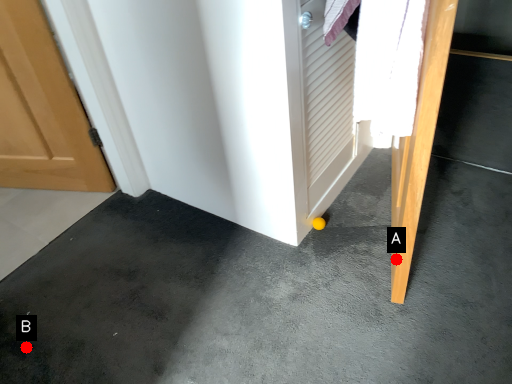
Question: Two points are circled on the image, labeled by A and B beside each circle. Among these points, which one is nearest to the camera?

Choices:
 (A) A is closer
 (B) B is closer

Answer: (A)